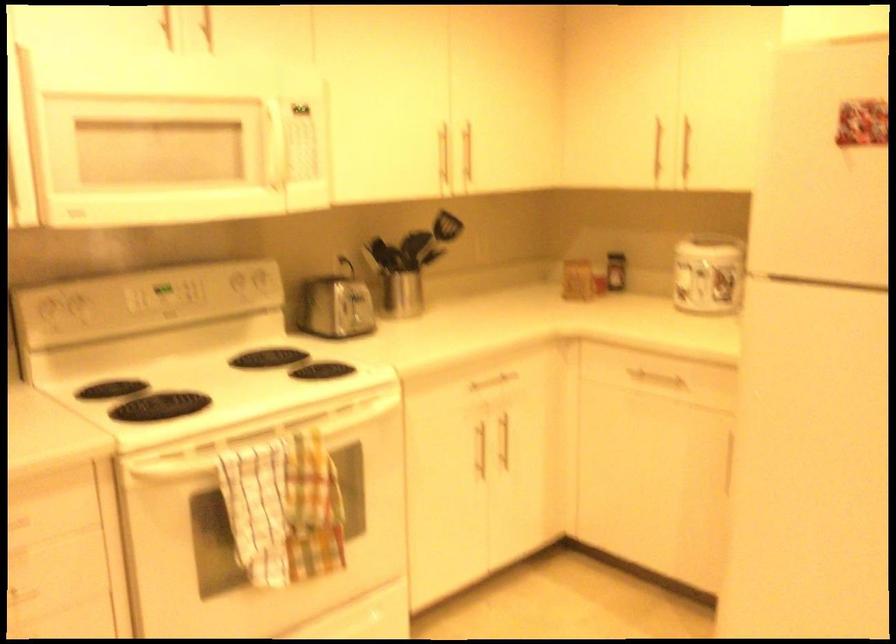
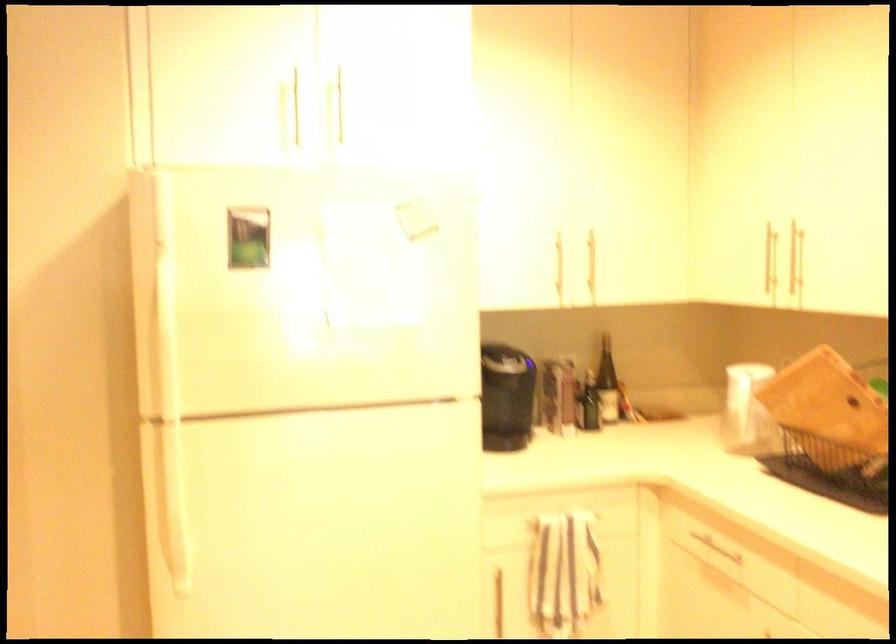
Question: The camera is either moving clockwise (left) or counter-clockwise (right) around the object. The first image is from the beginning of the video and the second image is from the end. Is the camera moving left or right when shooting the video?

Choices:
 (A) Left
 (B) Right

Answer: (A)